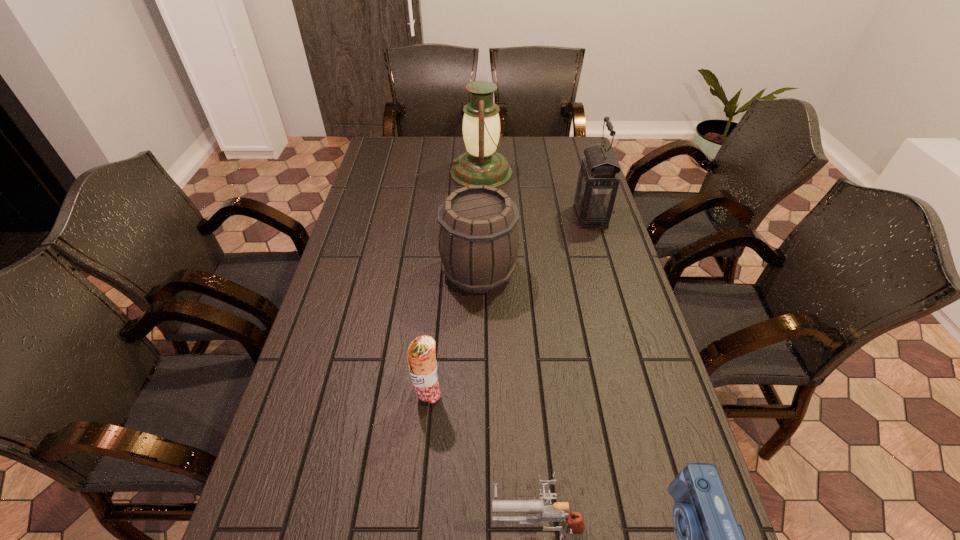
Identify the location of vacant space at the right edge of the desktop. The height and width of the screenshot is (540, 960). (568, 177).

Where is `vacant space that's between the third nearest object and the left lantern`? The image size is (960, 540). vacant space that's between the third nearest object and the left lantern is located at coordinates (455, 285).

Where is `empty space that is in between the fourth tallest object and the left lantern`? The height and width of the screenshot is (540, 960). empty space that is in between the fourth tallest object and the left lantern is located at coordinates (455, 285).

The image size is (960, 540). I want to click on free space between the fifth nearest object and the third nearest object, so click(509, 306).

The image size is (960, 540). Identify the location of free space between the third shortest object and the left lantern. (455, 285).

This screenshot has height=540, width=960. What are the coordinates of `object that is the fourth closest to the third nearest object` in the screenshot? It's located at (598, 180).

Identify which object is located as the nearest to the wine bucket. Please provide its 2D coordinates. Your answer should be formatted as a tuple, i.e. [(x, y)], where the tuple contains the x and y coordinates of a point satisfying the conditions above.

[(598, 180)]

Locate an element on the screen. free space that satisfies the following two spatial constraints: 1. with the light compartment facing forward on the left lantern; 2. on the front side of the third nearest object is located at coordinates (482, 396).

Where is `vacant space that satisfies the following two spatial constraints: 1. on the back side of the third shortest object; 2. on the right side of the wine bucket`? The height and width of the screenshot is (540, 960). vacant space that satisfies the following two spatial constraints: 1. on the back side of the third shortest object; 2. on the right side of the wine bucket is located at coordinates (440, 272).

Locate an element on the screen. This screenshot has width=960, height=540. vacant space that satisfies the following two spatial constraints: 1. with the light compartment facing forward on the left lantern; 2. on the front side of the fourth nearest object is located at coordinates (482, 272).